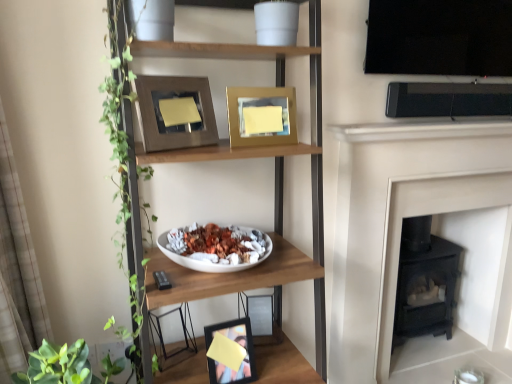
Identify the location of free location above black matte fireplace at right (from a real-world perspective). The height and width of the screenshot is (384, 512). (443, 142).